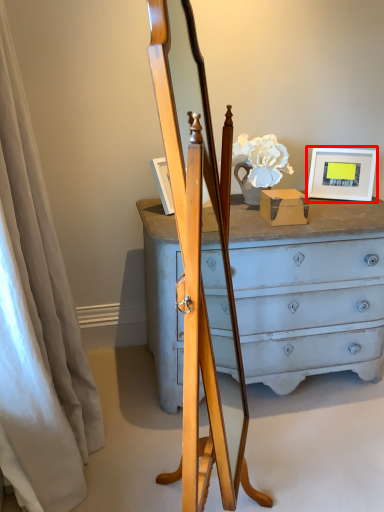
Question: From the image's perspective, where is picture frame (annotated by the red box) located in relation to curtain in the image?

Choices:
 (A) below
 (B) above

Answer: (B)